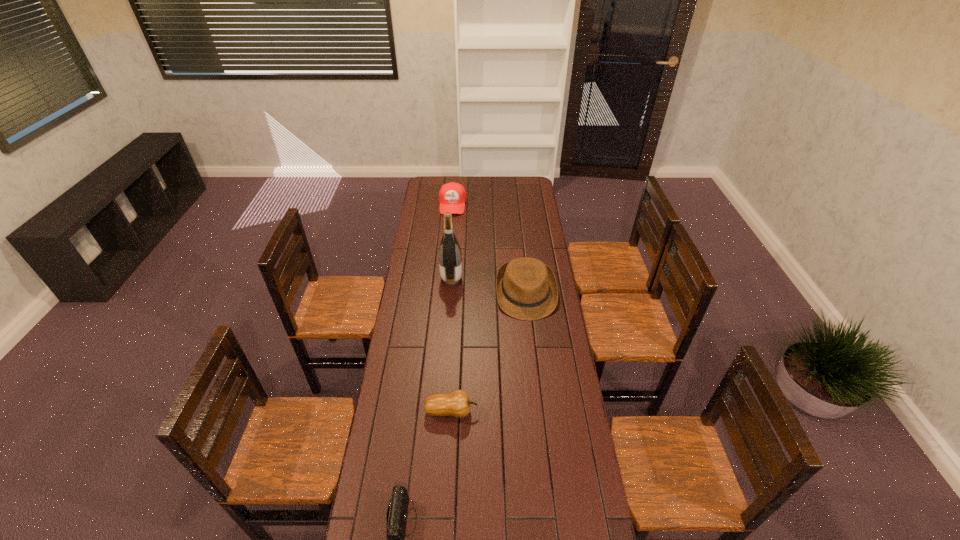
At what (x,y) coordinates should I click in order to perform the action: click on object that can be found as the fourth closest to the baseball cap. Please return your answer as a coordinate pair (x, y). This screenshot has width=960, height=540. Looking at the image, I should click on (396, 517).